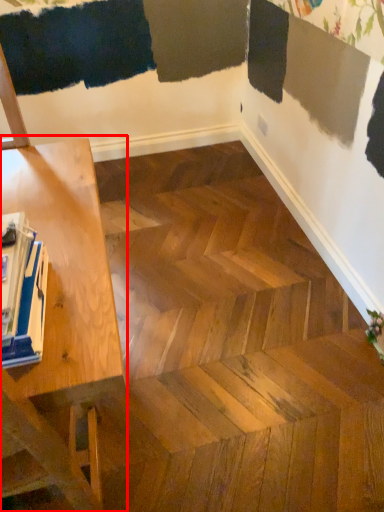
Question: From the image's perspective, considering the relative positions of table (annotated by the red box) and magazine in the image provided, where is table (annotated by the red box) located with respect to the staircase?

Choices:
 (A) above
 (B) below

Answer: (B)